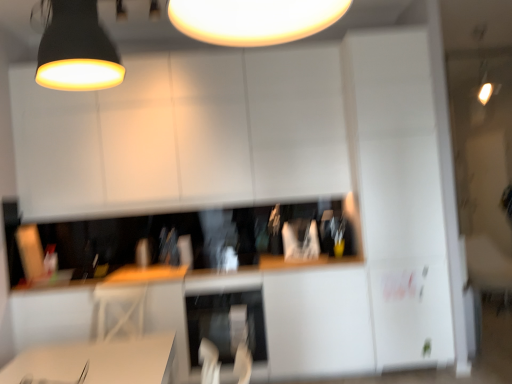
What do you see at coordinates (77, 50) in the screenshot? This screenshot has height=384, width=512. I see `matte black lampshade at upper left, which appears as the 2th lamp when viewed from the top` at bounding box center [77, 50].

The height and width of the screenshot is (384, 512). In order to click on white glossy computer desk at lower center in this screenshot , I will do [x=52, y=316].

Are white glossy computer desk at lower center and matte black lampshade at upper center, the first lamp in the back-to-front sequence, located far from each other?

That's right, there is a large distance between white glossy computer desk at lower center and matte black lampshade at upper center, the first lamp in the back-to-front sequence.

Considering the positions of objects white glossy computer desk at lower center and matte black lampshade at upper center, positioned as the 1th lamp in top-to-bottom order, in the image provided, who is more to the left, white glossy computer desk at lower center or matte black lampshade at upper center, positioned as the 1th lamp in top-to-bottom order,?

white glossy computer desk at lower center.

Can we say white glossy computer desk at lower center lies outside matte black lampshade at upper center, which is counted as the first lamp, starting from the right?

white glossy computer desk at lower center is positioned outside matte black lampshade at upper center, which is counted as the first lamp, starting from the right.

From the image's perspective, is white glossy computer desk at lower center on top of matte black lampshade at upper center, which is counted as the first lamp, starting from the right?

No, from the image's perspective, white glossy computer desk at lower center is not on top of matte black lampshade at upper center, which is counted as the first lamp, starting from the right.

Does white glossy computer desk at lower center lie behind matte black lampshade at upper left, which is the 1th lamp in bottom-to-top order?

Yes, the depth of white glossy computer desk at lower center is greater than that of matte black lampshade at upper left, which is the 1th lamp in bottom-to-top order.

Is white glossy computer desk at lower center aimed at matte black lampshade at upper left, which is the 1th lamp in bottom-to-top order?

No, white glossy computer desk at lower center is not aimed at matte black lampshade at upper left, which is the 1th lamp in bottom-to-top order.

Who is smaller, white glossy computer desk at lower center or matte black lampshade at upper left, marked as the second lamp in a back-to-front arrangement?

Smaller between the two is matte black lampshade at upper left, marked as the second lamp in a back-to-front arrangement.

Between matte black lampshade at upper left, the second lamp when ordered from right to left, and satin silver dishwasher at center, which one is positioned behind?

satin silver dishwasher at center is further from the camera.

Which is in front, point (101, 43) or point (255, 300)?

Positioned in front is point (101, 43).

From a real-world perspective, which object stands above the other?

matte black lampshade at upper left, which is counted as the 1th lamp, starting from the front, is physically above.

Which is more to the right, matte black lampshade at upper left, marked as the second lamp in a back-to-front arrangement, or matte black lampshade at upper center, arranged as the 2th lamp when viewed from the front?

matte black lampshade at upper center, arranged as the 2th lamp when viewed from the front, is more to the right.

Is matte black lampshade at upper left, which is counted as the 1th lamp, starting from the front, thinner than matte black lampshade at upper center, acting as the second lamp starting from the bottom?

Yes.

Does matte black lampshade at upper left, which is counted as the 1th lamp, starting from the front, have a lesser height compared to matte black lampshade at upper center, arranged as the 2th lamp when viewed from the front?

No, matte black lampshade at upper left, which is counted as the 1th lamp, starting from the front, is not shorter than matte black lampshade at upper center, arranged as the 2th lamp when viewed from the front.

You are a GUI agent. You are given a task and a screenshot of the screen. Output one action in this format:
    pyautogui.click(x=<x>, y=<y>)
    Task: Click on the lamp in front of the matte black lampshade at upper center, acting as the second lamp starting from the bottom
    Image resolution: width=512 pixels, height=384 pixels.
    Given the screenshot: What is the action you would take?
    pyautogui.click(x=77, y=50)

From a real-world perspective, is matte black lampshade at upper center, the first lamp in the back-to-front sequence, beneath satin silver dishwasher at center?

Actually, matte black lampshade at upper center, the first lamp in the back-to-front sequence, is physically above satin silver dishwasher at center in the real world.

Is matte black lampshade at upper center, acting as the second lamp starting from the bottom, situated inside satin silver dishwasher at center or outside?

matte black lampshade at upper center, acting as the second lamp starting from the bottom, is spatially situated outside satin silver dishwasher at center.

Is matte black lampshade at upper center, the first lamp in the back-to-front sequence, smaller than satin silver dishwasher at center?

No, matte black lampshade at upper center, the first lamp in the back-to-front sequence, is not smaller than satin silver dishwasher at center.

Is matte black lampshade at upper center, which appears as the 2th lamp when viewed from the left, thinner than satin silver dishwasher at center?

No.

Find the location of a particular element. This screenshot has height=384, width=512. computer desk above the satin silver dishwasher at center (from the image's perspective) is located at coordinates (52, 316).

Relative to white glossy computer desk at lower center, is satin silver dishwasher at center in front or behind?

Clearly, satin silver dishwasher at center is behind white glossy computer desk at lower center.

Do you think satin silver dishwasher at center is within white glossy computer desk at lower center, or outside of it?

satin silver dishwasher at center cannot be found inside white glossy computer desk at lower center.

Does satin silver dishwasher at center touch white glossy computer desk at lower center?

No, satin silver dishwasher at center is not in contact with white glossy computer desk at lower center.

Is satin silver dishwasher at center touching matte black lampshade at upper center, which appears as the 2th lamp when viewed from the left?

No.

From a real-world perspective, is satin silver dishwasher at center physically above matte black lampshade at upper center, arranged as the 2th lamp when viewed from the front?

Incorrect, from a real-world perspective, satin silver dishwasher at center is lower than matte black lampshade at upper center, arranged as the 2th lamp when viewed from the front.

Looking at this image, between satin silver dishwasher at center and matte black lampshade at upper center, arranged as the 2th lamp when viewed from the front, which one appears on the right side from the viewer's perspective?

From the viewer's perspective, matte black lampshade at upper center, arranged as the 2th lamp when viewed from the front, appears more on the right side.

Where is `computer desk below the matte black lampshade at upper center, which appears as the 2th lamp when viewed from the left (from a real-world perspective)`? The width and height of the screenshot is (512, 384). computer desk below the matte black lampshade at upper center, which appears as the 2th lamp when viewed from the left (from a real-world perspective) is located at coordinates (52, 316).

Locate an element on the screen. The width and height of the screenshot is (512, 384). lamp that is the 1st one when counting rightward from the white glossy computer desk at lower center is located at coordinates click(x=77, y=50).

Considering their positions, is matte black lampshade at upper center, the first lamp in the back-to-front sequence, positioned closer to satin silver dishwasher at center than white glossy computer desk at lower center?

The object closer to satin silver dishwasher at center is white glossy computer desk at lower center.

From the picture: When comparing their distances from white glossy computer desk at lower center, does matte black lampshade at upper left, the second lamp when ordered from right to left, or satin silver dishwasher at center seem closer?

Based on the image, satin silver dishwasher at center appears to be nearer to white glossy computer desk at lower center.

Looking at the image, which one is located further to matte black lampshade at upper left, the 1th lamp positioned from the left, matte black lampshade at upper center, which appears as the 2th lamp when viewed from the left, or white glossy computer desk at lower center?

white glossy computer desk at lower center.

Looking at the image, which one is located further to white glossy computer desk at lower center, satin silver dishwasher at center or matte black lampshade at upper left, marked as the second lamp in a back-to-front arrangement?

matte black lampshade at upper left, marked as the second lamp in a back-to-front arrangement, lies further to white glossy computer desk at lower center than the other object.

In the scene shown: Looking at the image, which one is located closer to matte black lampshade at upper center, which is counted as the first lamp, starting from the right, satin silver dishwasher at center or matte black lampshade at upper left, which appears as the 2th lamp when viewed from the top?

matte black lampshade at upper left, which appears as the 2th lamp when viewed from the top, is positioned closer to the anchor matte black lampshade at upper center, which is counted as the first lamp, starting from the right.

From the image, which object appears to be nearer to matte black lampshade at upper center, positioned as the 1th lamp in top-to-bottom order, matte black lampshade at upper left, which is the 1th lamp in bottom-to-top order, or white glossy computer desk at lower center?

The object closer to matte black lampshade at upper center, positioned as the 1th lamp in top-to-bottom order, is matte black lampshade at upper left, which is the 1th lamp in bottom-to-top order.

Estimate the real-world distances between objects in this image. Which object is further from satin silver dishwasher at center, matte black lampshade at upper left, the second lamp when ordered from right to left, or matte black lampshade at upper center, which is counted as the first lamp, starting from the right?

The object further to satin silver dishwasher at center is matte black lampshade at upper center, which is counted as the first lamp, starting from the right.

Which object lies further to the anchor point matte black lampshade at upper left, marked as the second lamp in a back-to-front arrangement, white glossy computer desk at lower center or matte black lampshade at upper center, which is counted as the first lamp, starting from the right?

Among the two, white glossy computer desk at lower center is located further to matte black lampshade at upper left, marked as the second lamp in a back-to-front arrangement.

Locate an element on the screen. lamp that lies between matte black lampshade at upper center, which appears as the 2th lamp when viewed from the left, and satin silver dishwasher at center from top to bottom is located at coordinates (77, 50).

Identify the location of computer desk between matte black lampshade at upper left, which appears as the 2th lamp when viewed from the top, and satin silver dishwasher at center vertically. [x=52, y=316].

Locate an element on the screen. The width and height of the screenshot is (512, 384). computer desk that lies between matte black lampshade at upper center, which is counted as the first lamp, starting from the right, and satin silver dishwasher at center from top to bottom is located at coordinates (52, 316).

This screenshot has width=512, height=384. I want to click on lamp between matte black lampshade at upper center, which is counted as the first lamp, starting from the right, and white glossy computer desk at lower center, in the vertical direction, so [x=77, y=50].